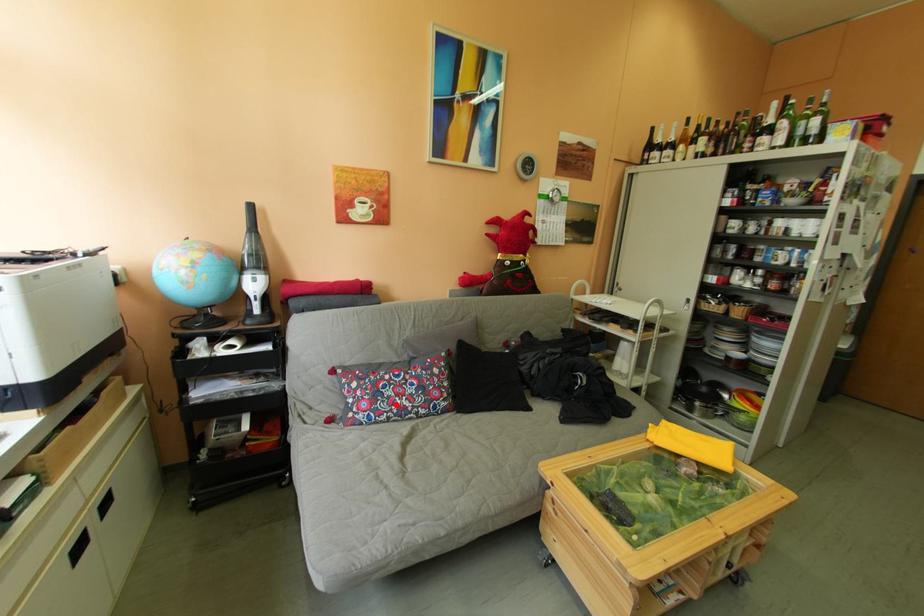
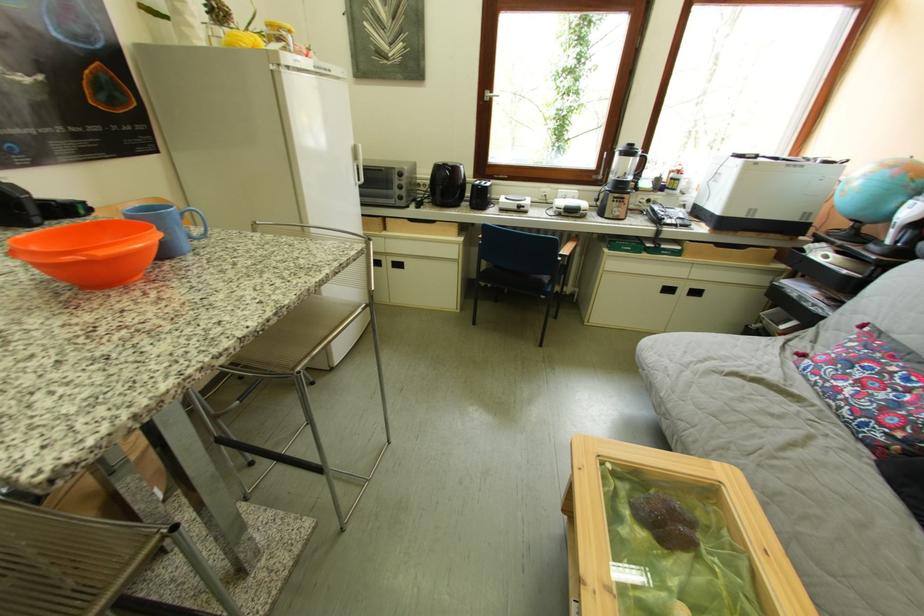
Question: I am providing you with two images of the same scene from different viewpoints. A red point is marked on the first image. At the location where the point appears in image 1, is it still visible in image 2?

Choices:
 (A) Yes
 (B) No

Answer: (A)